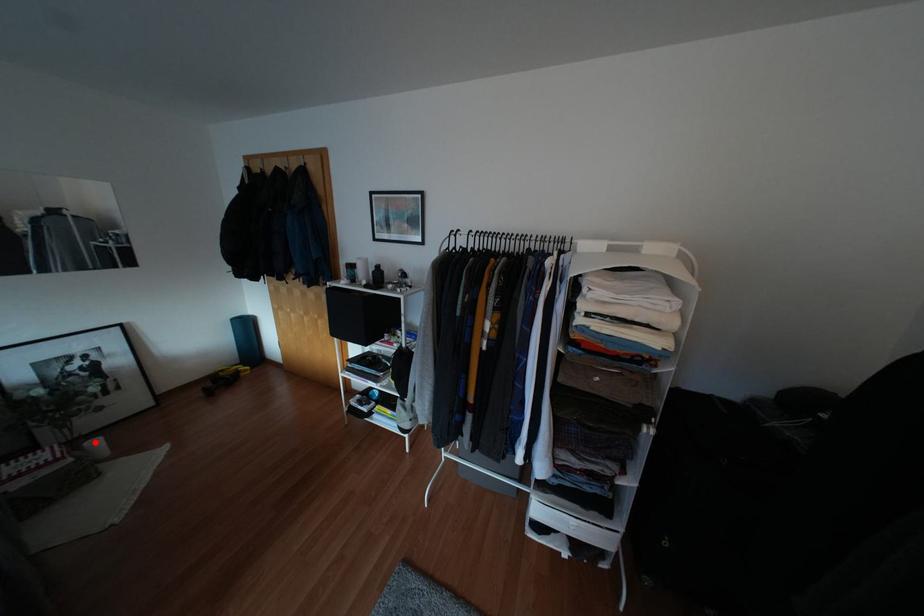
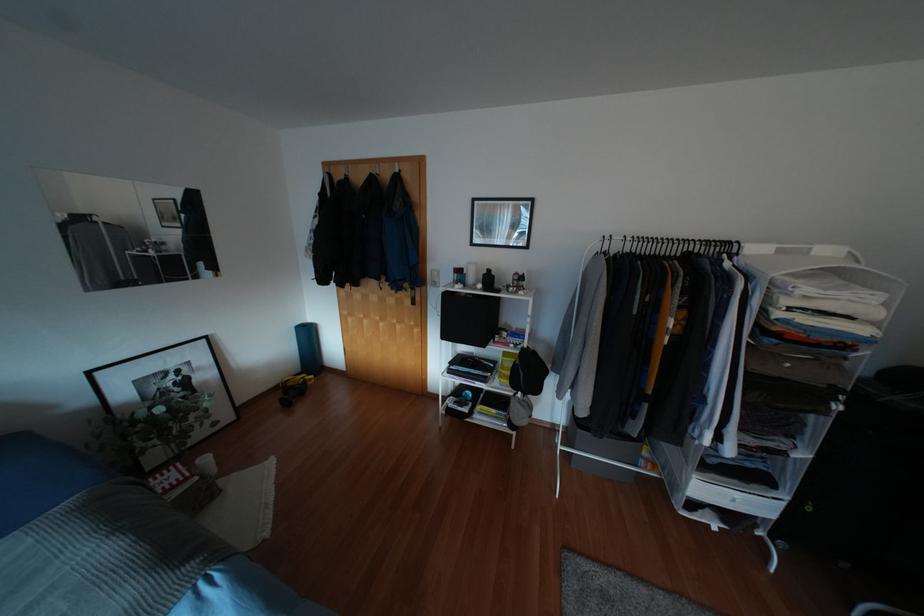
Question: I am providing you with two images of the same scene from different viewpoints. A red point is shown in image1. For the corresponding object point in image2, is it positioned nearer or farther from the camera?

Choices:
 (A) Nearer
 (B) Farther

Answer: (A)